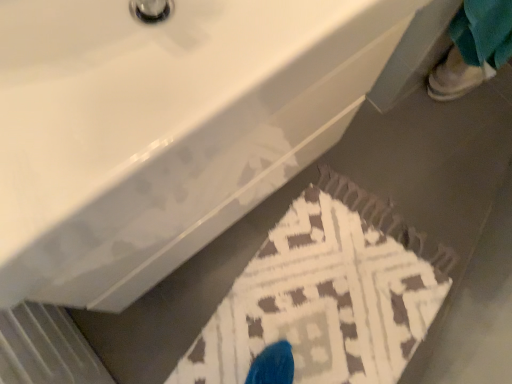
Question: From the image's perspective, relative to white glossy sink at upper center, is brown textured rug at lower center above or below?

Choices:
 (A) above
 (B) below

Answer: (B)

Question: From their relative heights in the image, would you say brown textured rug at lower center is taller or shorter than white glossy sink at upper center?

Choices:
 (A) short
 (B) tall

Answer: (A)

Question: Which object is the farthest from the white leather shoe at upper right?

Choices:
 (A) brown textured rug at lower center
 (B) white glossy sink at upper center

Answer: (B)

Question: Which is farther from the brown textured rug at lower center?

Choices:
 (A) white leather shoe at upper right
 (B) white glossy sink at upper center

Answer: (A)